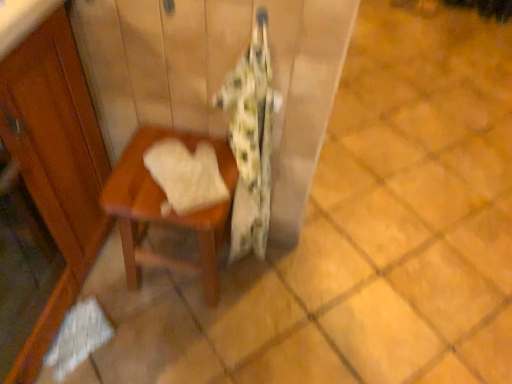
What are the coordinates of `free point below fluffy white blanket at center (from a real-world perspective)` in the screenshot? It's located at (246, 267).